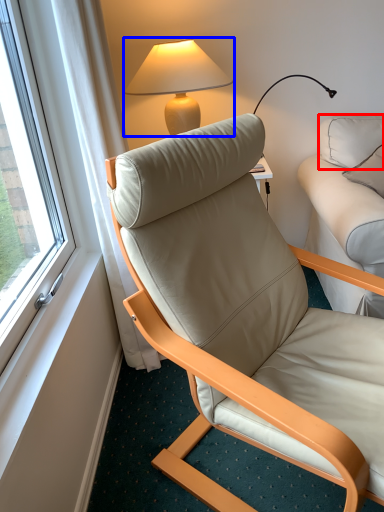
Question: Which object appears farthest to the camera in this image, pillow (highlighted by a red box) or lamp (highlighted by a blue box)?

Choices:
 (A) pillow
 (B) lamp

Answer: (B)